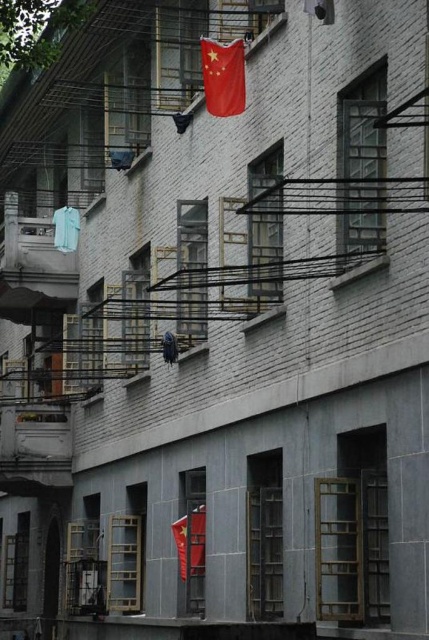
How distant is red fabric flag at center from blue fabric at center?

red fabric flag at center and blue fabric at center are 1.86 meters apart from each other.

Is point (195, 520) farther from camera compared to point (169, 339)?

That is False.

You are a GUI agent. You are given a task and a screenshot of the screen. Output one action in this format:
    pyautogui.click(x=<x>, y=<y>)
    Task: Click on the red fabric flag at center
    Image resolution: width=429 pixels, height=640 pixels.
    Given the screenshot: What is the action you would take?
    pyautogui.click(x=190, y=541)

Looking at this image, which of these two, red fabric flag at upper center or red fabric flag at center, stands shorter?

red fabric flag at upper center

How distant is red fabric flag at upper center from red fabric flag at center?

red fabric flag at upper center is 14.71 feet away from red fabric flag at center.

Does point (218, 65) lie in front of point (202, 509)?

Yes, point (218, 65) is in front of point (202, 509).

This screenshot has height=640, width=429. Find the location of `red fabric flag at upper center`. red fabric flag at upper center is located at coordinates (223, 76).

Which is below, red fabric flag at upper center or blue fabric at center?

blue fabric at center

Who is shorter, red fabric flag at upper center or blue fabric at center?

Standing shorter between the two is blue fabric at center.

Between point (207, 100) and point (177, 349), which one is positioned in front?

Point (207, 100) is in front.

You are a GUI agent. You are given a task and a screenshot of the screen. Output one action in this format:
    pyautogui.click(x=<x>, y=<y>)
    Task: Click on the red fabric flag at upper center
    This screenshot has width=429, height=640.
    Given the screenshot: What is the action you would take?
    [223, 76]